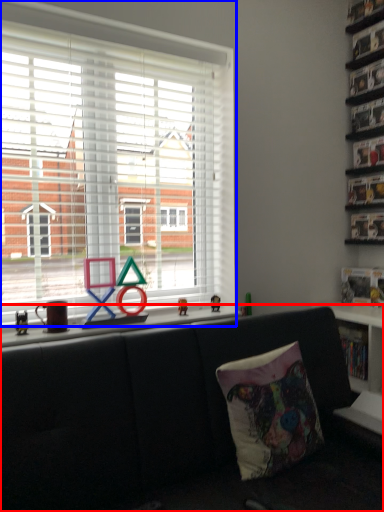
Question: Which object appears closest to the camera in this image, studio couch (highlighted by a red box) or window (highlighted by a blue box)?

Choices:
 (A) studio couch
 (B) window

Answer: (A)